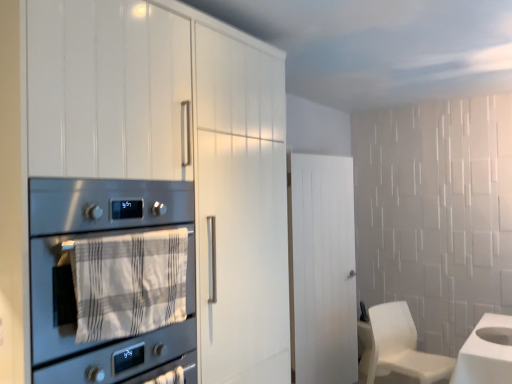
Question: From a real-world perspective, is white wood door at center physically located above or below white matte chair at lower right?

Choices:
 (A) below
 (B) above

Answer: (B)

Question: Is point (348, 286) closer or farther from the camera than point (444, 357)?

Choices:
 (A) closer
 (B) farther

Answer: (B)

Question: Considering the real-world distances, which object is farthest from the white matte cabinet at left?

Choices:
 (A) white matte chair at lower right
 (B) white textured towel at center
 (C) stainless steel oven at left
 (D) white wood door at center

Answer: (A)

Question: Estimate the real-world distances between objects in this image. Which object is farther from the stainless steel oven at left?

Choices:
 (A) white matte cabinet at left
 (B) white textured towel at center
 (C) white matte chair at lower right
 (D) white wood door at center

Answer: (C)